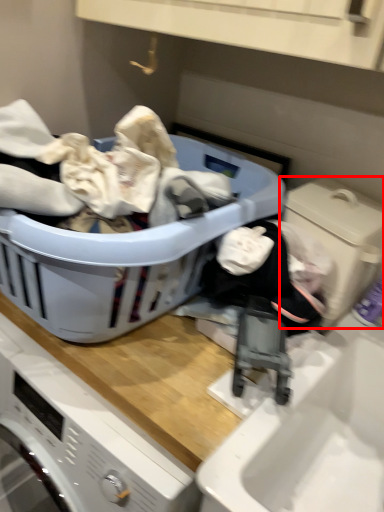
Question: Considering the relative positions of washing machine (annotated by the red box) and laundry basket in the image provided, where is washing machine (annotated by the red box) located with respect to the staircase?

Choices:
 (A) right
 (B) left

Answer: (A)